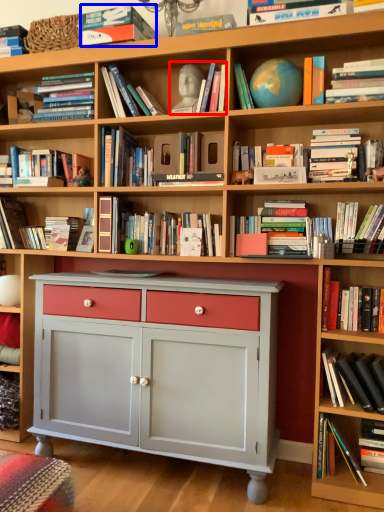
Question: Which object appears farthest to the camera in this image, book (highlighted by a red box) or book (highlighted by a blue box)?

Choices:
 (A) book
 (B) book

Answer: (A)